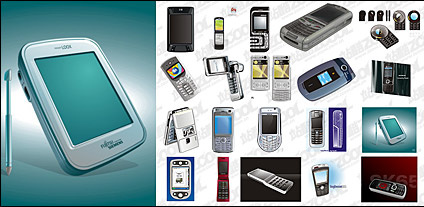
At what (x,y) coordinates should I click in order to perform the action: click on black screen. Please return your answer as a coordinate pair (x, y). Looking at the image, I should click on (268, 121), (179, 26), (327, 14), (223, 165), (315, 122).